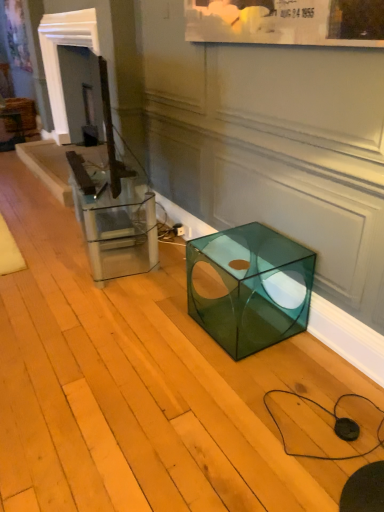
Image resolution: width=384 pixels, height=512 pixels. I want to click on free spot to the left of transparent green cube at lower right, so click(157, 332).